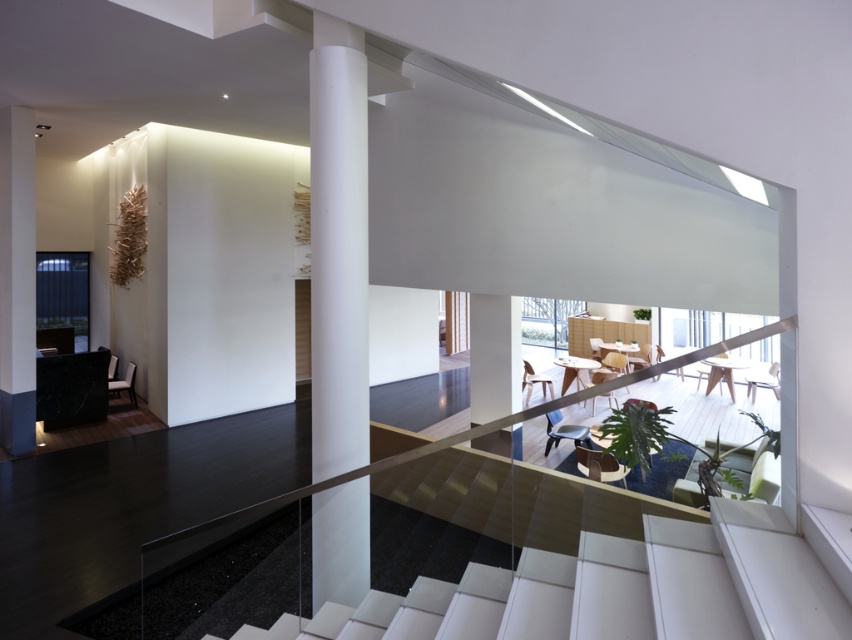
You are an interior designer assessing the space. You need to place a 1.2 meter wide decorative panel between the white glossy stair at center and the white matte column at upper left. Based on their widths, will the panel fit without overlapping either object?

The white glossy stair at center is wider than the white matte column at upper left. Since the panel is 1.2 meters wide, it depends on the actual widths of the stair and column. However, since the stair is wider, there might be sufficient space between them. But without exact measurements, we can only confirm that the stair is wider, so the panel may fit if the combined width of both objects allows it.

You are designing a new interior space and want to ensure accessibility for wheelchairs. The wheelchair requires a minimum of 90 cm width for maneuvering. You observe the white glossy stair at center and the white glossy column at center. Which of these two objects meets the minimum width requirement for wheelchair access?

The white glossy stair at center has a larger width than the white glossy column at center, so it meets the minimum width requirement for wheelchair access.

You are standing at the top of the staircase in this modern interior space. You want to place a 2.5 meter long decorative sculpture on the floor directly in front of the white glossy stair at center. Is there enough space between you and the stair to safely place the sculpture without it extending beyond the staircase?

The distance from the viewer to the white glossy stair at center is 2.07 meters. Since the sculpture is 2.5 meters long, it would extend beyond the staircase. Therefore, there isn not enough space to safely place the sculpture without it extending beyond the staircase.